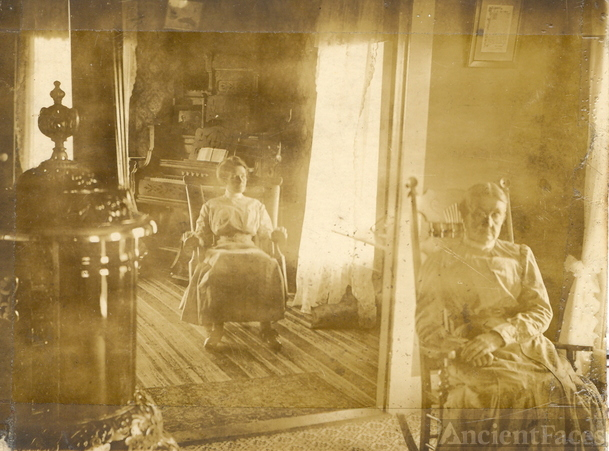
You are a GUI agent. You are given a task and a screenshot of the screen. Output one action in this format:
    pyautogui.click(x=<x>, y=<y>)
    Task: Click on the picture
    The height and width of the screenshot is (451, 609).
    Given the screenshot: What is the action you would take?
    pyautogui.click(x=174, y=21), pyautogui.click(x=500, y=41)